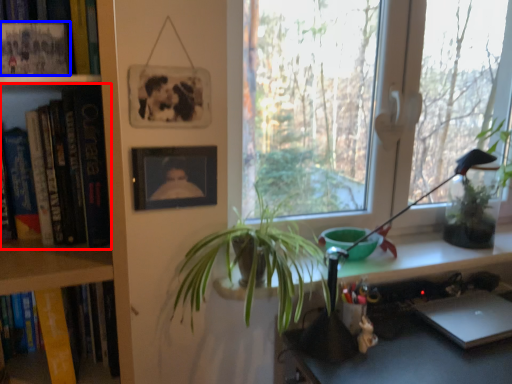
Question: Among these objects, which one is nearest to the camera, book (highlighted by a red box) or book (highlighted by a blue box)?

Choices:
 (A) book
 (B) book

Answer: (B)